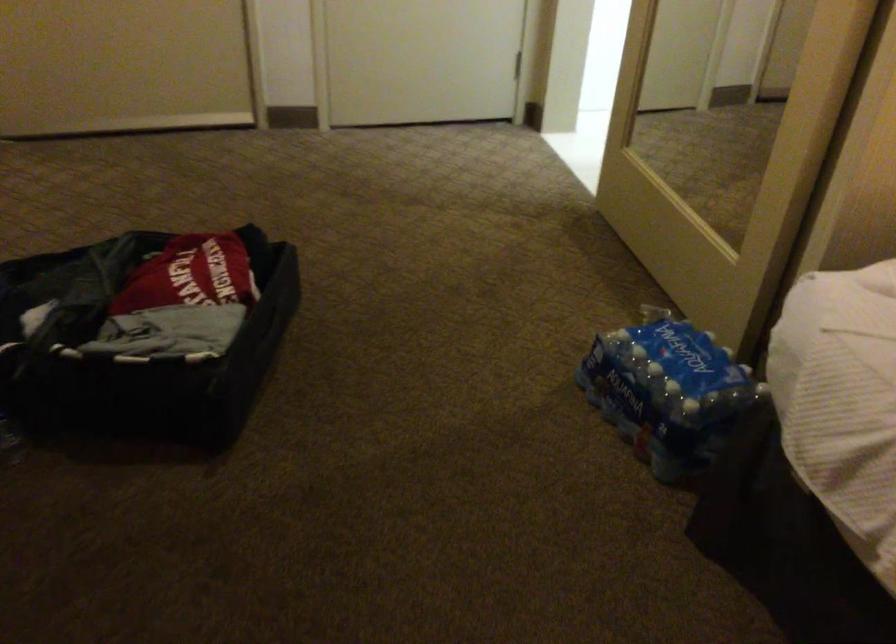
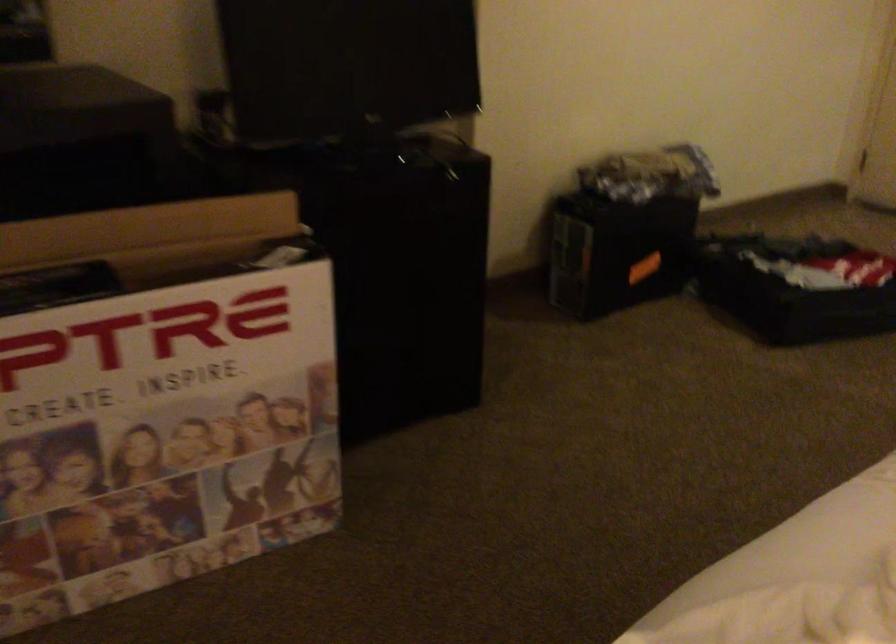
In the second image, find the point that corresponds to point (221, 372) in the first image.

(794, 287)